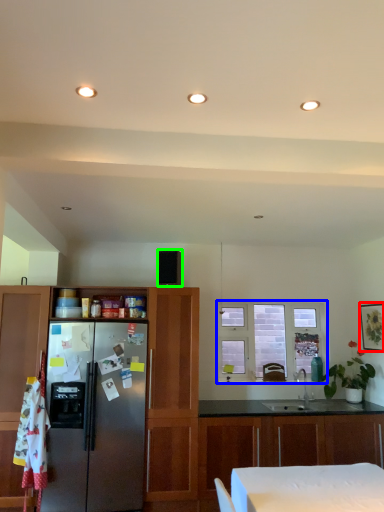
Question: Which object is the farthest from picture frame (highlighted by a red box)? Choose among these: window (highlighted by a blue box) or appliance (highlighted by a green box).

Choices:
 (A) window
 (B) appliance

Answer: (B)